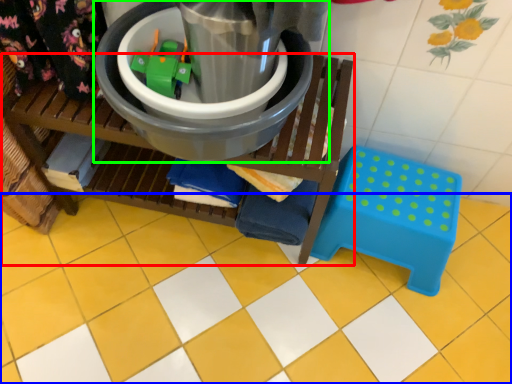
Question: Which object is positioned closest to furniture (highlighted by a red box)? Select from ceramic tile (highlighted by a blue box) and appliance (highlighted by a green box).

Choices:
 (A) ceramic tile
 (B) appliance

Answer: (B)